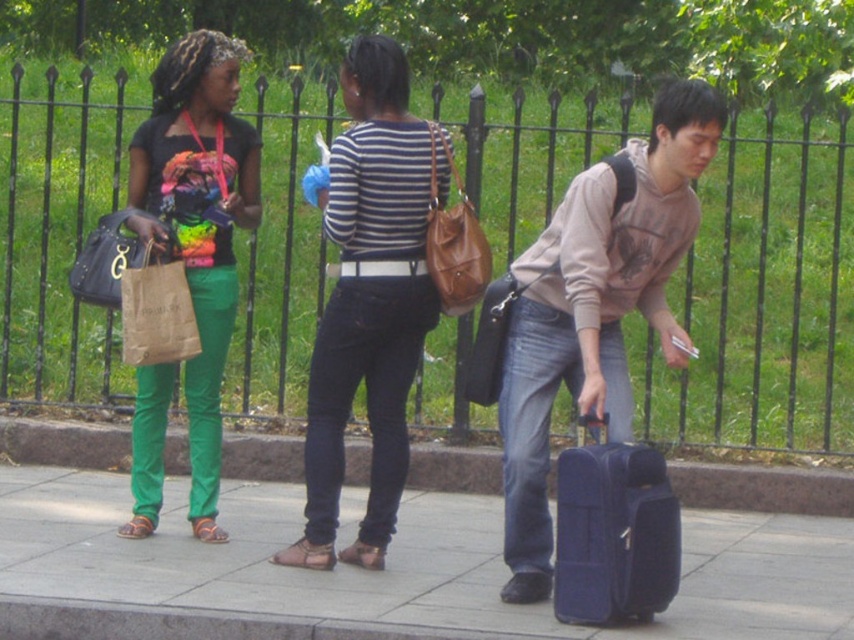
Question: Can you confirm if smooth concrete pavement at center is positioned below matte black shirt at left?

Choices:
 (A) no
 (B) yes

Answer: (B)

Question: Which object appears farthest from the camera in this image?

Choices:
 (A) blue fabric suitcase at lower right
 (B) black metal fence at upper center
 (C) matte gray hoodie at center

Answer: (B)

Question: Among these objects, which one is nearest to the camera?

Choices:
 (A) black metal fence at upper center
 (B) matte gray hoodie at center

Answer: (B)

Question: Is black metal fence at upper center positioned at the back of striped cotton shirt at center?

Choices:
 (A) no
 (B) yes

Answer: (B)

Question: Is smooth concrete pavement at center smaller than matte gray hoodie at center?

Choices:
 (A) yes
 (B) no

Answer: (A)

Question: Estimate the real-world distances between objects in this image. Which object is farther from the matte gray hoodie at center?

Choices:
 (A) matte black shirt at left
 (B) black metal fence at upper center
 (C) striped cotton shirt at center

Answer: (B)